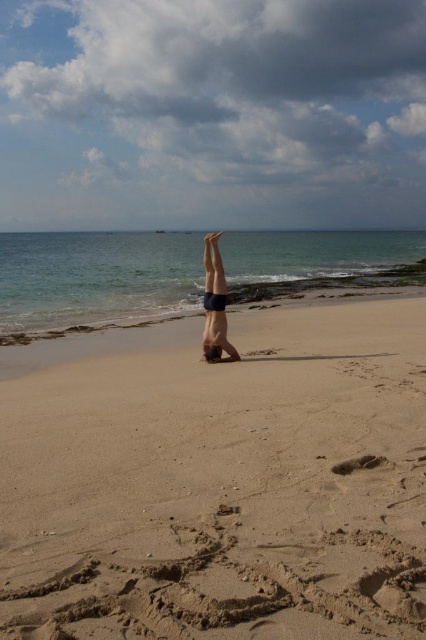
Question: Is sandy tan at center wider than smooth skin person at center?

Choices:
 (A) no
 (B) yes

Answer: (B)

Question: Among these objects, which one is nearest to the camera?

Choices:
 (A) sandy tan at center
 (B) smooth skin person at center

Answer: (A)

Question: Which point is closer to the camera?

Choices:
 (A) (276, 472)
 (B) (206, 355)

Answer: (A)

Question: Does sandy tan at center appear over smooth skin person at center?

Choices:
 (A) yes
 (B) no

Answer: (B)

Question: Can you confirm if sandy tan at center is wider than smooth skin person at center?

Choices:
 (A) yes
 (B) no

Answer: (A)

Question: Which point is farther to the camera?

Choices:
 (A) (213, 340)
 (B) (333, 480)

Answer: (A)